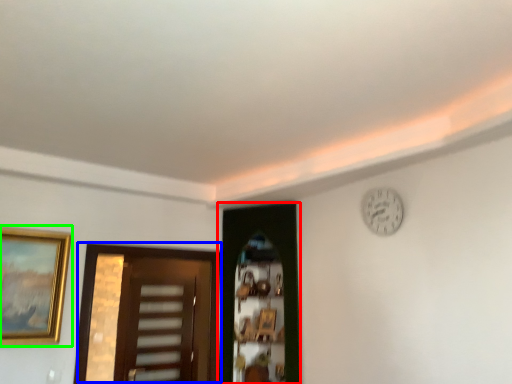
Question: Considering the real-world distances, which object is farthest from door (highlighted by a red box)? door (highlighted by a blue box) or picture frame (highlighted by a green box)?

Choices:
 (A) door
 (B) picture frame

Answer: (A)